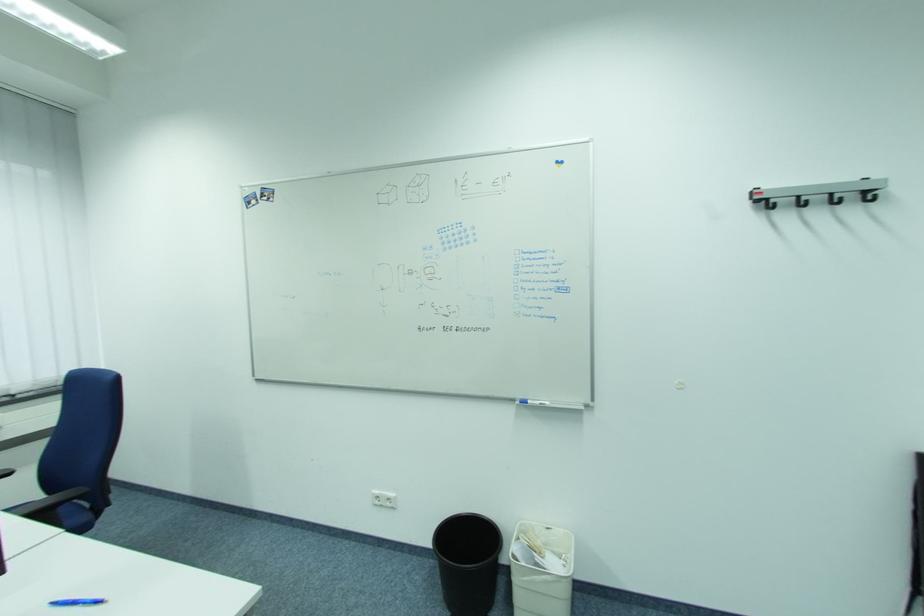
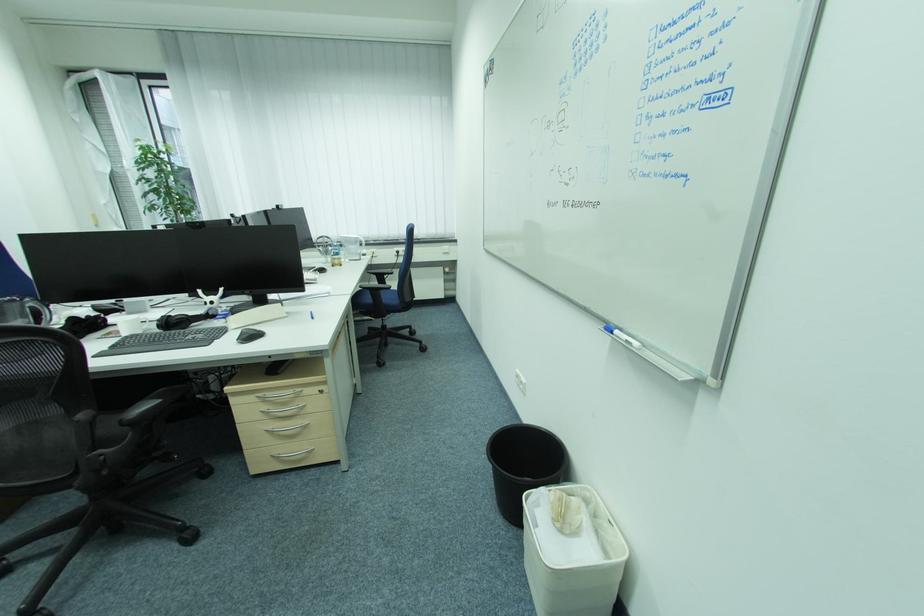
In the second image, find the point that corresponds to (533,403) in the first image.

(618, 334)